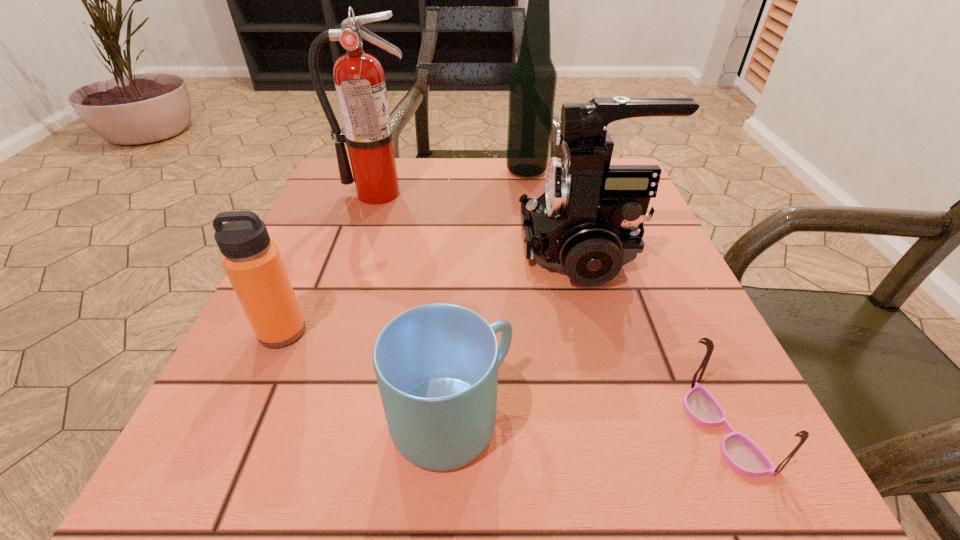
Locate an element on the screen. The height and width of the screenshot is (540, 960). alcohol is located at coordinates (533, 78).

Find the location of a particular element. The width and height of the screenshot is (960, 540). fire extinguisher is located at coordinates click(x=359, y=78).

This screenshot has height=540, width=960. I want to click on the fourth shortest object, so click(x=585, y=225).

Locate an element on the screen. The width and height of the screenshot is (960, 540). the fourth nearest object is located at coordinates (585, 225).

The image size is (960, 540). In order to click on the fourth tallest object in this screenshot , I will do `click(253, 264)`.

This screenshot has height=540, width=960. In order to click on the fourth farthest object in this screenshot , I will do `click(253, 264)`.

Image resolution: width=960 pixels, height=540 pixels. What are the coordinates of `the third object from left to right` in the screenshot? It's located at (436, 365).

Find the location of a particular element. the fifth tallest object is located at coordinates (436, 365).

Image resolution: width=960 pixels, height=540 pixels. What are the coordinates of `spectacles` in the screenshot? It's located at (742, 454).

Identify the location of free point located on the left of the alcohol. (372, 171).